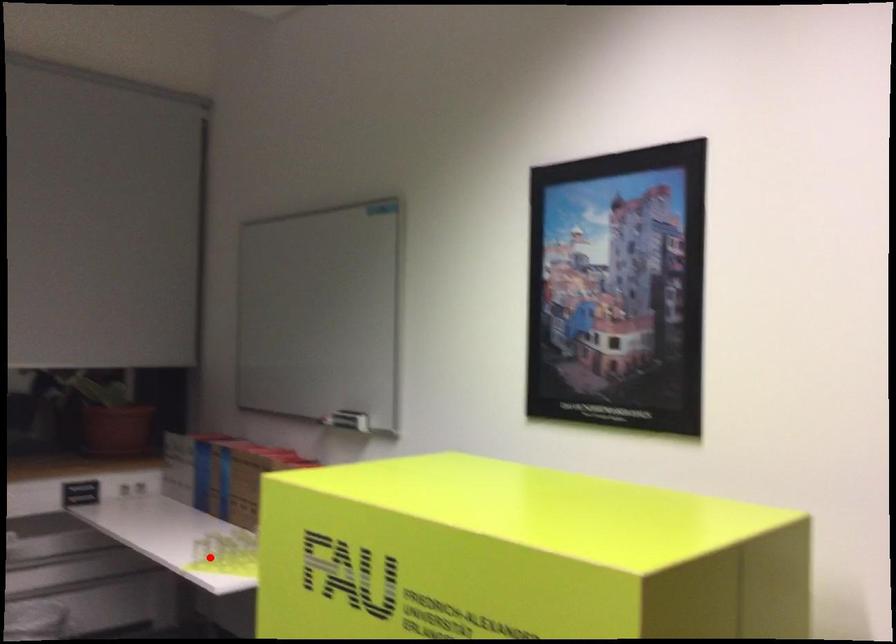
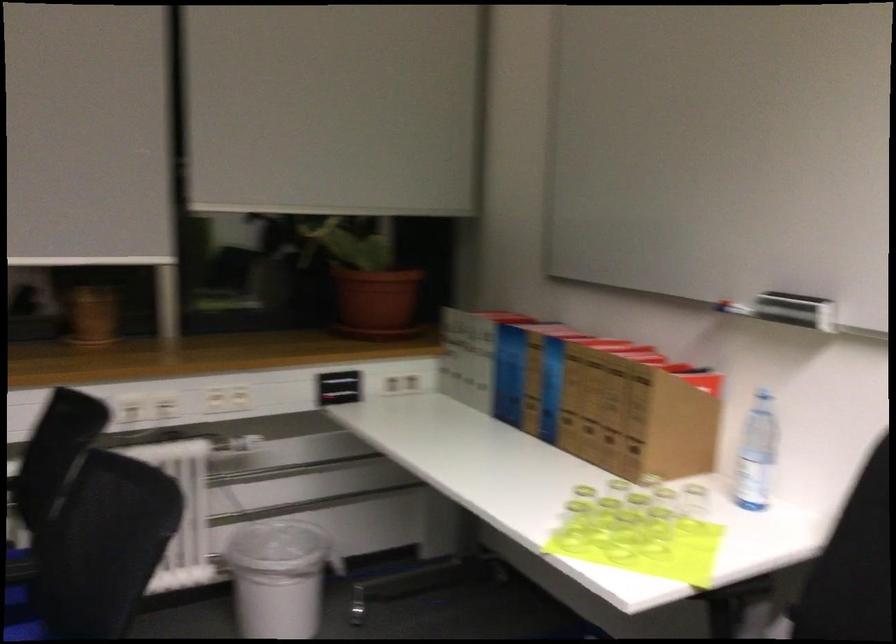
Question: I am providing you with two images of the same scene from different viewpoints. In image1, a red point is highlighted. Considering the same 3D point in image2, which of the following is correct?

Choices:
 (A) It is closer
 (B) It is farther

Answer: (A)